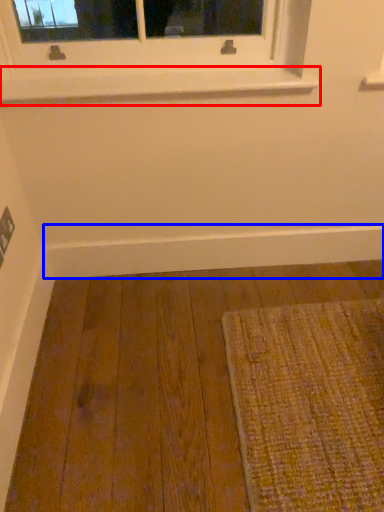
Question: Which object is further to the camera taking this photo, window sill (highlighted by a red box) or molding (highlighted by a blue box)?

Choices:
 (A) window sill
 (B) molding

Answer: (B)